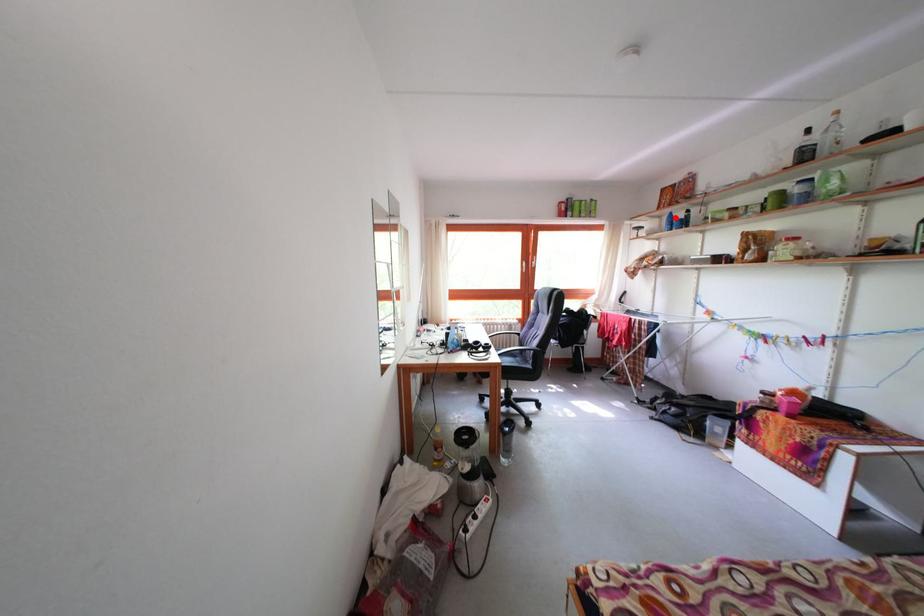
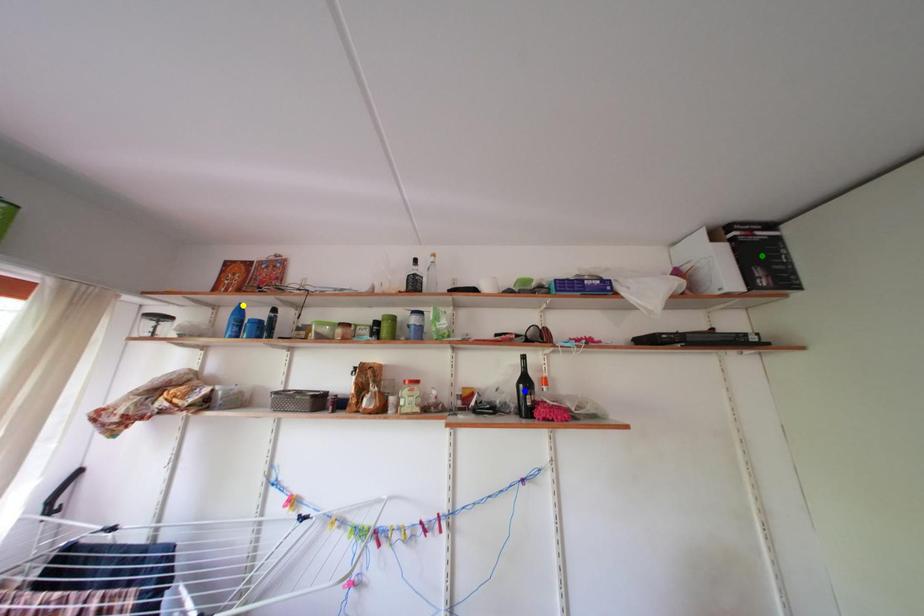
Question: I am providing you with two images of the same scene from different viewpoints. A red point is marked on the first image. You are given multiple points on the second image. Can you choose the point in image 2 that corresponds to the point in image 1?

Choices:
 (A) green point
 (B) blue point
 (C) yellow point

Answer: (C)